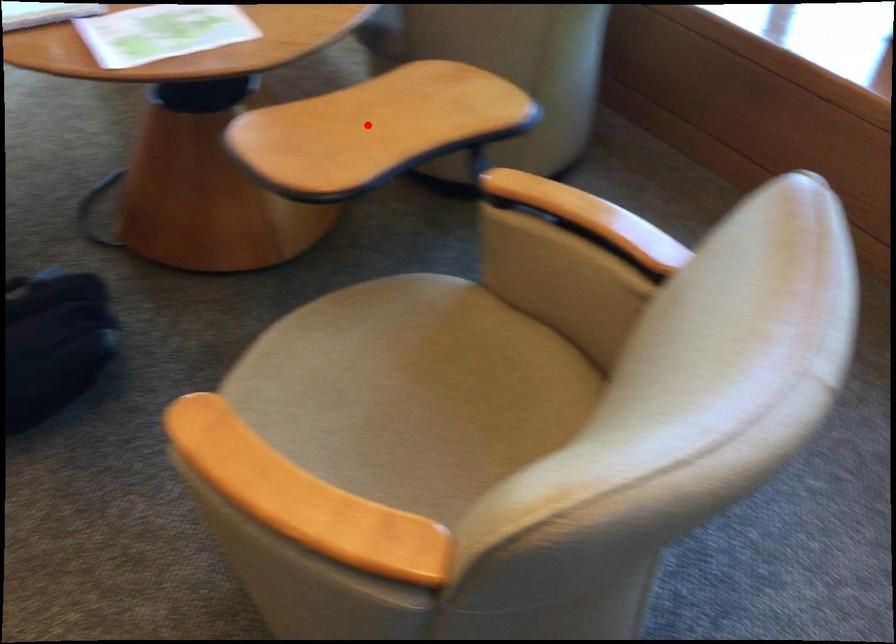
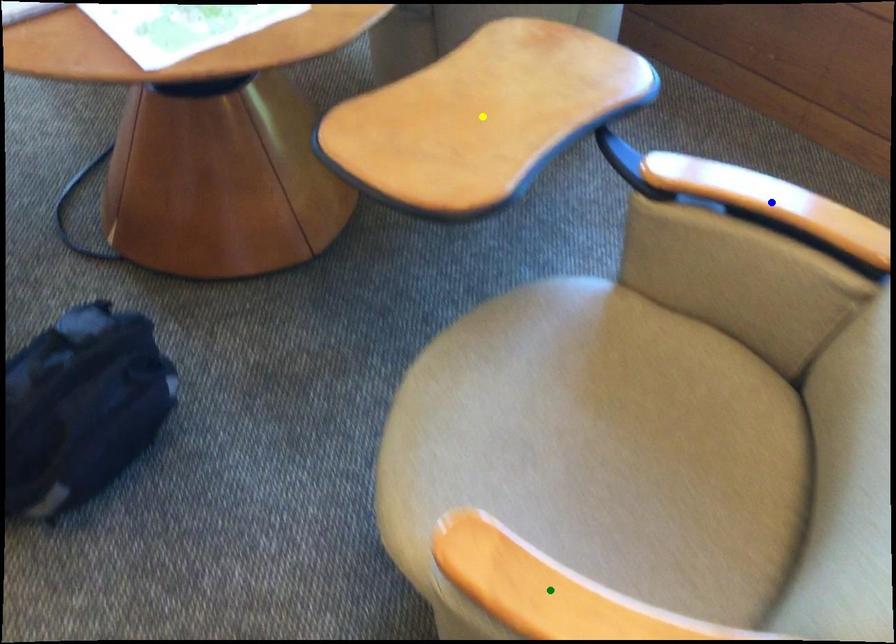
Question: I am providing you with two images of the same scene from different viewpoints. A red point is marked on the first image. You are given multiple points on the second image. Which mark in image 2 goes with the point in image 1?

Choices:
 (A) blue point
 (B) yellow point
 (C) green point

Answer: (B)